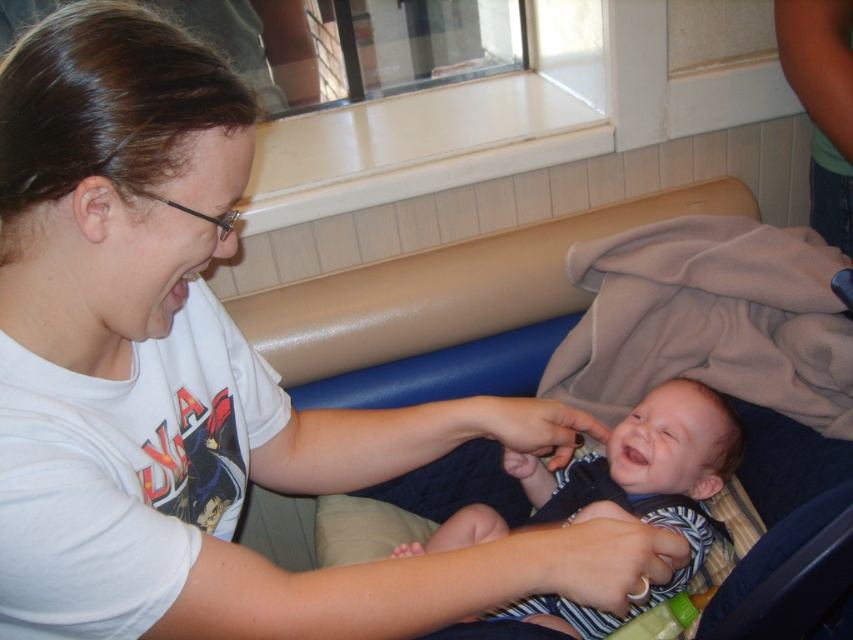
Question: Does dark blue fabric baby carriage at center have a lesser width compared to striped fabric baby at center?

Choices:
 (A) yes
 (B) no

Answer: (B)

Question: Can you confirm if dark blue fabric baby carriage at center is wider than striped fabric baby at center?

Choices:
 (A) yes
 (B) no

Answer: (A)

Question: Which point appears farthest from the camera in this image?

Choices:
 (A) (782, 497)
 (B) (651, 483)

Answer: (B)

Question: Is dark blue fabric baby carriage at center below striped fabric baby at center?

Choices:
 (A) no
 (B) yes

Answer: (A)